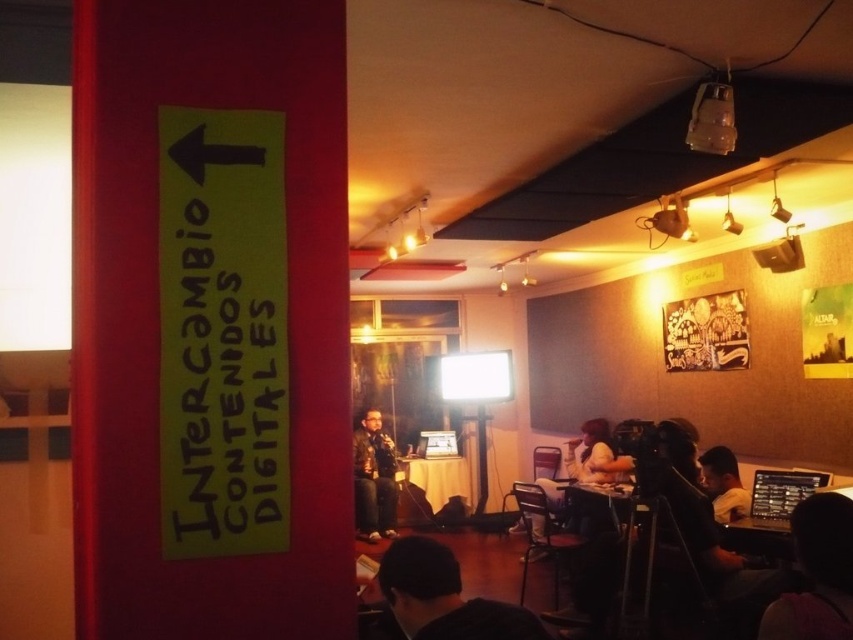
You are an attendee at this event and you want to get a closer look at the speaker. Which of the two leather jackets, the leather jacket at center or the light brown leather jacket at lower right, is blocking your path?

The light brown leather jacket at lower right is behind the leather jacket at center, so the leather jacket at center is blocking your path.

You are an attendee at the presentation and want to get a clear view of the speaker. Which object, the black leather jacket at lower center or the leather jacket at center, is closer to you?

The black leather jacket at lower center is closer to you than the leather jacket at center.

What is the position of the leather jacket at center in the image?

The leather jacket at center is located at point (373, 477).